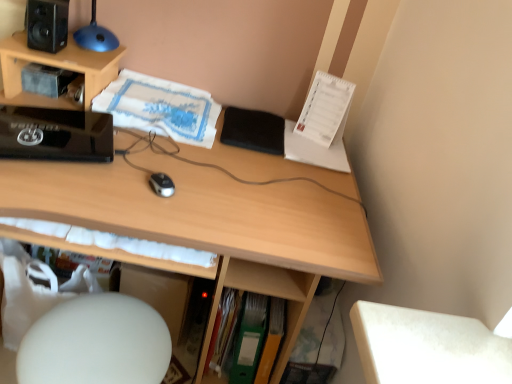
Question: Is green matte folder at lower center, the second book viewed from the left, completely or partially inside black matte notepad at center?

Choices:
 (A) yes
 (B) no

Answer: (B)

Question: From the image's perspective, is black matte notepad at center located beneath green matte folder at lower center, the second book viewed from the left?

Choices:
 (A) no
 (B) yes

Answer: (A)

Question: Does black matte notepad at center have a lesser width compared to green matte folder at lower center, the first book positioned from the bottom?

Choices:
 (A) no
 (B) yes

Answer: (A)

Question: Is black matte notepad at center positioned behind green matte folder at lower center, the first book viewed from the right?

Choices:
 (A) yes
 (B) no

Answer: (A)

Question: Is black matte notepad at center beside green matte folder at lower center, the first book positioned from the bottom?

Choices:
 (A) no
 (B) yes

Answer: (A)

Question: From the image's perspective, is green matte folder at lower center, marked as the first paperback book in a left-to-right arrangement, located above or below white matte computer chair at lower left?

Choices:
 (A) below
 (B) above

Answer: (B)

Question: Is green matte folder at lower center, marked as the first paperback book in a left-to-right arrangement, wider or thinner than white matte computer chair at lower left?

Choices:
 (A) thin
 (B) wide

Answer: (A)

Question: Choose the correct answer: Is green matte folder at lower center, which appears as the 2th paperback book when viewed from the right, inside white matte computer chair at lower left or outside it?

Choices:
 (A) inside
 (B) outside

Answer: (B)

Question: Considering the positions of green matte folder at lower center, marked as the first paperback book in a left-to-right arrangement, and white matte computer chair at lower left in the image, is green matte folder at lower center, marked as the first paperback book in a left-to-right arrangement, taller or shorter than white matte computer chair at lower left?

Choices:
 (A) tall
 (B) short

Answer: (B)

Question: Considering the relative positions of white paper at center, which ranks as the 1th book in left-to-right order, and black plastic mouse at center in the image provided, is white paper at center, which ranks as the 1th book in left-to-right order, to the left or to the right of black plastic mouse at center?

Choices:
 (A) right
 (B) left

Answer: (B)

Question: From their relative heights in the image, would you say white paper at center, the first book in the top-to-bottom sequence, is taller or shorter than black plastic mouse at center?

Choices:
 (A) short
 (B) tall

Answer: (B)

Question: Based on their sizes in the image, would you say white paper at center, which ranks as the 1th book in left-to-right order, is bigger or smaller than black plastic mouse at center?

Choices:
 (A) big
 (B) small

Answer: (A)

Question: Relative to black plastic mouse at center, is white paper at center, the 2th book positioned from the bottom, in front or behind?

Choices:
 (A) behind
 (B) front

Answer: (A)

Question: From the image's perspective, is green matte folder at lower center, which is counted as the first paperback book, starting from the right, positioned above or below black plastic mouse at center?

Choices:
 (A) below
 (B) above

Answer: (A)

Question: Does point (269, 312) appear closer or farther from the camera than point (166, 183)?

Choices:
 (A) farther
 (B) closer

Answer: (A)